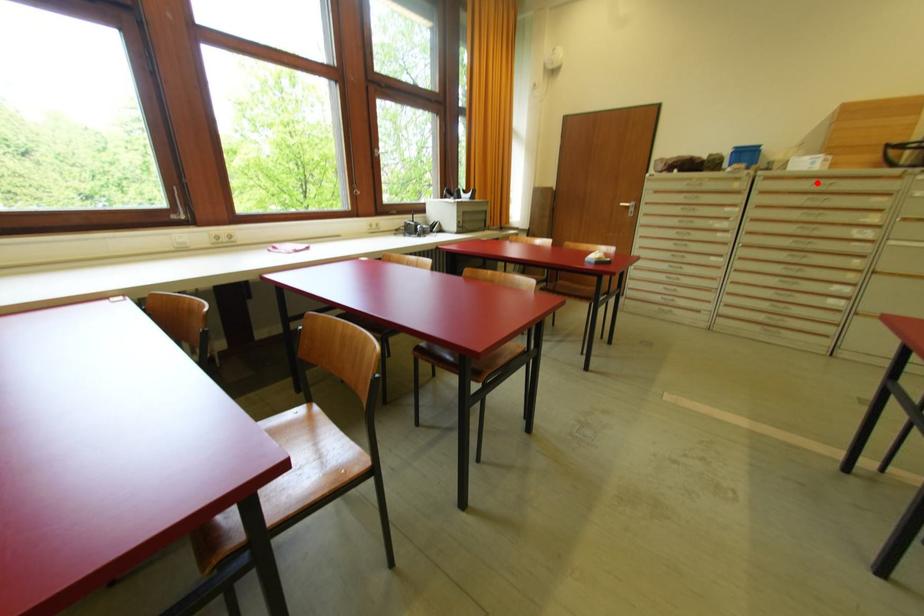
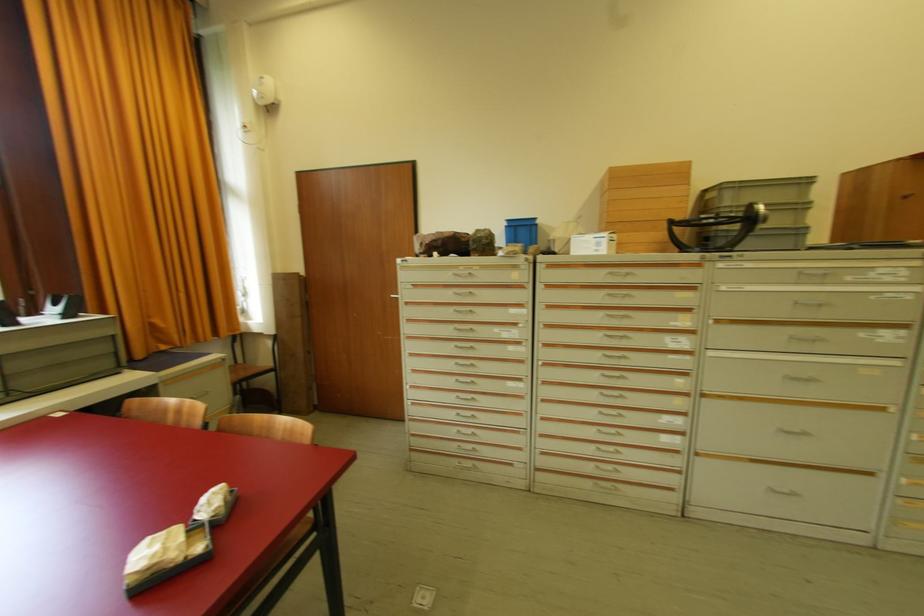
Question: I am providing you with two images of the same scene from different viewpoints. In image1, a red point is highlighted. Considering the same 3D point in image2, which of the following is correct?

Choices:
 (A) It is closer
 (B) It is farther

Answer: (A)